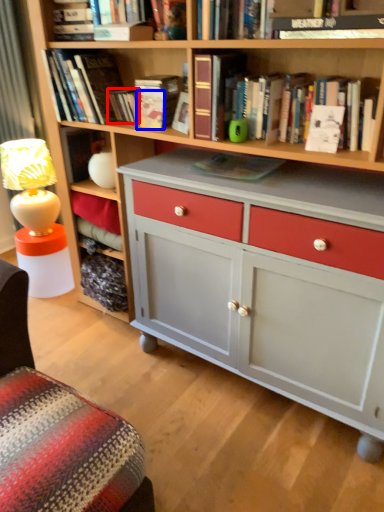
Question: Among these objects, which one is farthest to the camera, paperback book (highlighted by a red box) or paperback book (highlighted by a blue box)?

Choices:
 (A) paperback book
 (B) paperback book

Answer: (A)